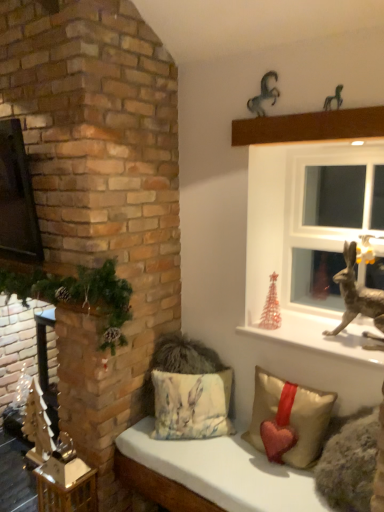
Image resolution: width=384 pixels, height=512 pixels. In order to click on free region on the left part of shiny metallic reindeer at right in this screenshot , I will do `click(304, 338)`.